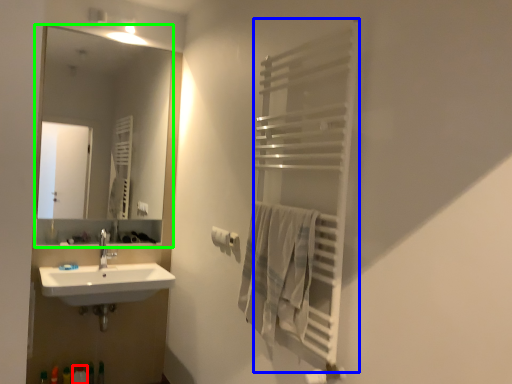
Question: Based on their relative distances, which object is nearer to toiletry (highlighted by a red box)? Choose from balustrade (highlighted by a blue box) and mirror (highlighted by a green box).

Choices:
 (A) balustrade
 (B) mirror

Answer: (A)